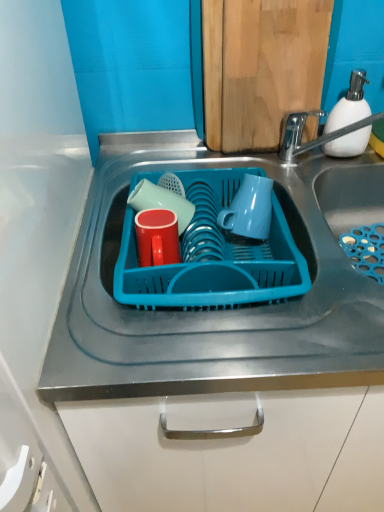
Question: From the image's perspective, relative to blue plastic basket at center, is white matte soap dispenser at upper right above or below?

Choices:
 (A) above
 (B) below

Answer: (A)

Question: From a real-world perspective, relative to blue plastic basket at center, is white matte soap dispenser at upper right vertically above or below?

Choices:
 (A) above
 (B) below

Answer: (A)

Question: Which object is the farthest from the white matte soap dispenser at upper right?

Choices:
 (A) matte blue mug at center
 (B) matte red cup at center, which is counted as the 2th tableware, starting from the front
 (C) blue plastic basket at center
 (D) blue plastic tray at center
 (E) matte red cup at center, the second tableware positioned from the back

Answer: (E)

Question: Which of these objects is positioned closest to the white matte soap dispenser at upper right?

Choices:
 (A) matte blue mug at center
 (B) blue plastic tray at center
 (C) matte red cup at center, the first tableware in the back-to-front sequence
 (D) matte red cup at center, the first tableware in the front-to-back sequence
 (E) blue plastic basket at center

Answer: (A)